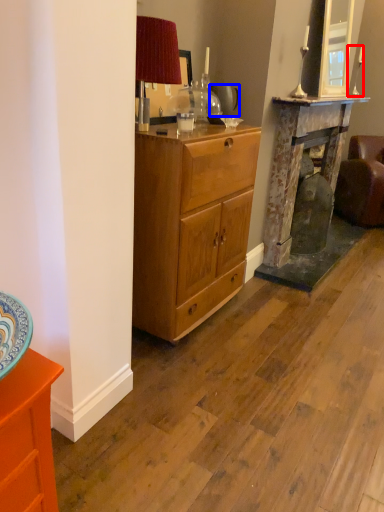
Question: Which object appears farthest to the camera in this image, candle holder (highlighted by a red box) or teapot (highlighted by a blue box)?

Choices:
 (A) candle holder
 (B) teapot

Answer: (A)